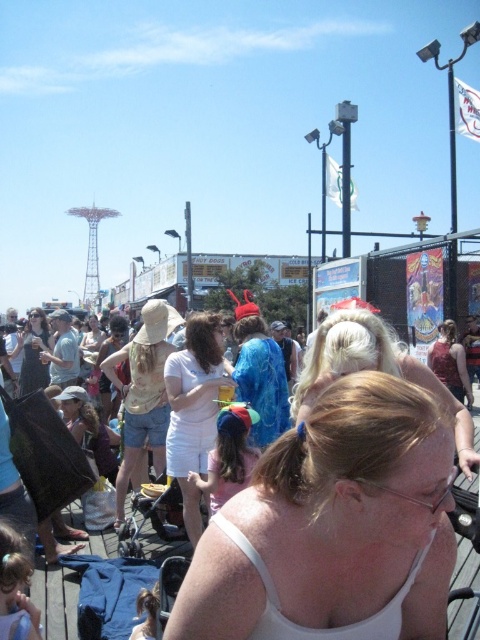
Is beige straw hat at center thinner than matte black bag at center?

Yes, beige straw hat at center is thinner than matte black bag at center.

Locate an element on the screen. beige straw hat at center is located at coordinates 143,394.

Who is higher up, white cotton dress at center or beige straw hat at center?

white cotton dress at center

Does white cotton dress at center appear under beige straw hat at center?

Actually, white cotton dress at center is above beige straw hat at center.

Does point (175, 365) lie in front of point (135, 381)?

Yes, point (175, 365) is closer to viewer.

This screenshot has height=640, width=480. I want to click on white cotton dress at center, so click(193, 410).

Looking at this image, between white fabric at center and blonde hair at center, which one is positioned lower?

white fabric at center is lower down.

The height and width of the screenshot is (640, 480). What do you see at coordinates (334, 525) in the screenshot?
I see `white fabric at center` at bounding box center [334, 525].

At what (x,y) coordinates should I click in order to perform the action: click on white fabric at center. Please return your answer as a coordinate pair (x, y). Looking at the image, I should click on (334, 525).